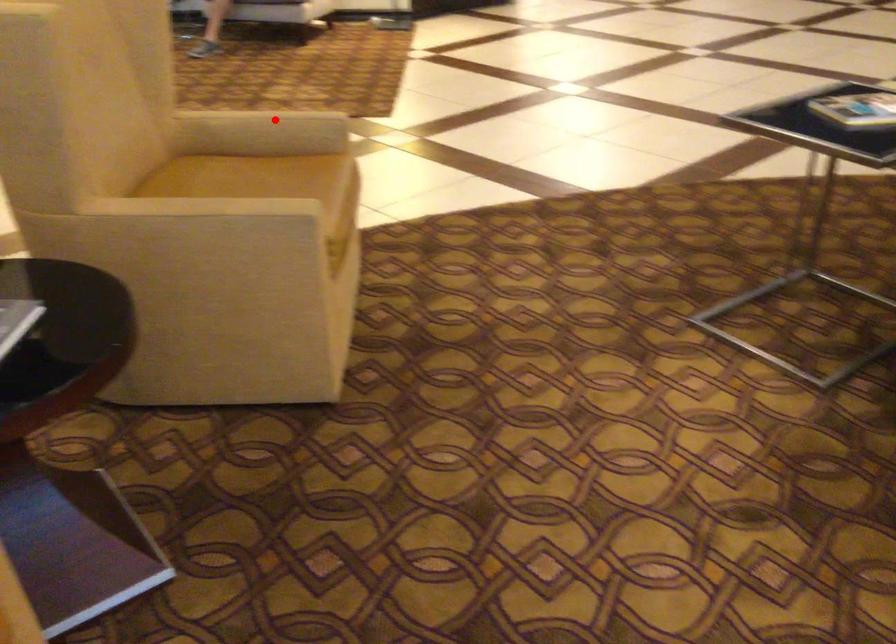
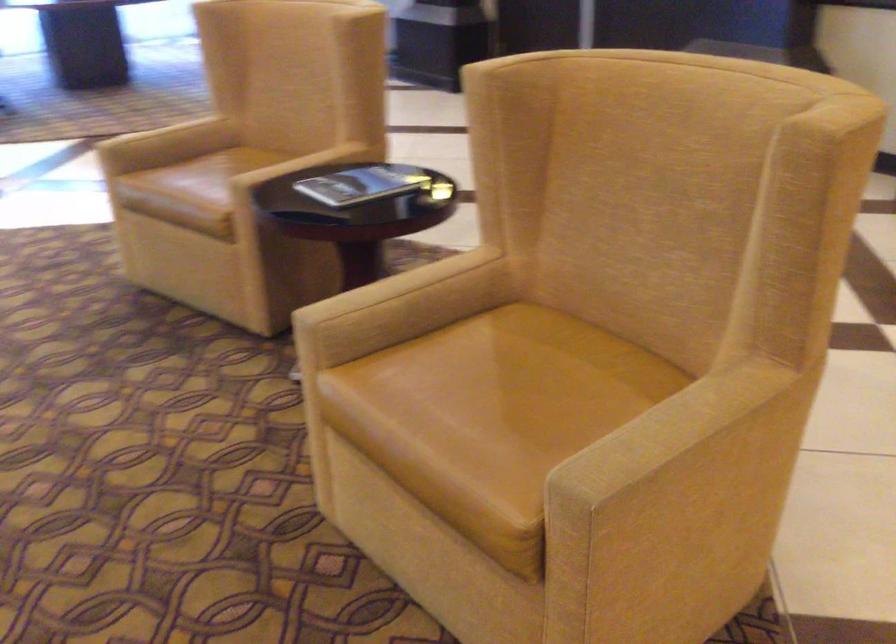
Question: I am providing you with two images of the same scene from different viewpoints. In image1, a red point is highlighted. Considering the same 3D point in image2, which of the following is correct?

Choices:
 (A) It is closer
 (B) It is farther

Answer: (A)